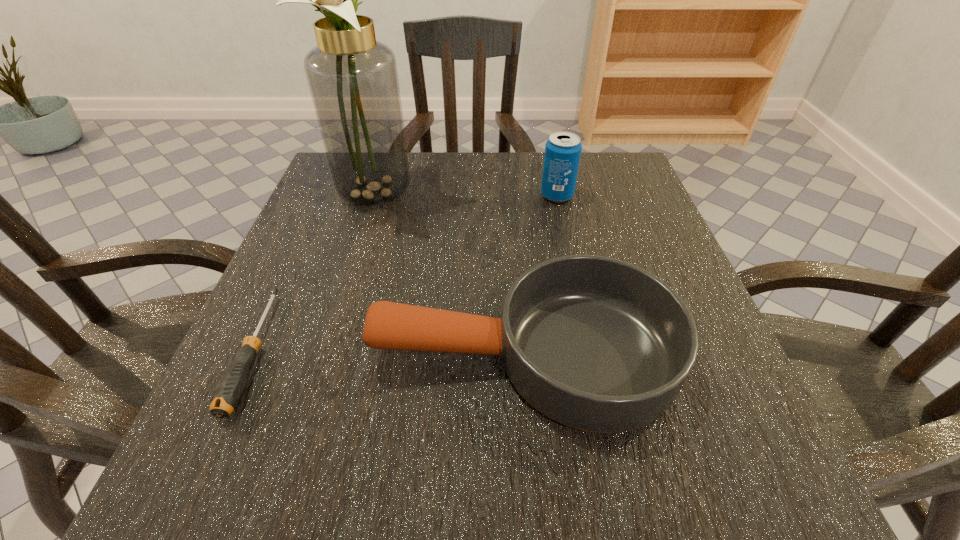
At what (x,y) coordinates should I click in order to perform the action: click on flower arrangement. Please return your answer as a coordinate pair (x, y). The image size is (960, 540). Looking at the image, I should click on (353, 80).

Identify the location of the second tallest object. (563, 149).

The width and height of the screenshot is (960, 540). I want to click on the second shortest object, so click(x=597, y=344).

Identify the location of the shortest object. The image size is (960, 540). (230, 388).

Find the location of a particular element. screwdriver is located at coordinates (230, 388).

Image resolution: width=960 pixels, height=540 pixels. In order to click on free space located 0.150m on the right of the tallest object in this screenshot , I will do `click(493, 192)`.

You are a GUI agent. You are given a task and a screenshot of the screen. Output one action in this format:
    pyautogui.click(x=<x>, y=<y>)
    Task: Click on the vacant space located 0.110m on the right of the second tallest object
    The image size is (960, 540).
    Given the screenshot: What is the action you would take?
    pyautogui.click(x=623, y=195)

The width and height of the screenshot is (960, 540). Find the location of `vacant space situated 0.130m on the handle side of the third tallest object`. vacant space situated 0.130m on the handle side of the third tallest object is located at coordinates (287, 355).

This screenshot has height=540, width=960. Find the location of `blank space located on the handle side of the third tallest object`. blank space located on the handle side of the third tallest object is located at coordinates (293, 355).

At what (x,y) coordinates should I click in order to perform the action: click on free space located 0.190m on the handle side of the third tallest object. Please return your answer as a coordinate pair (x, y). Looking at the image, I should click on (247, 355).